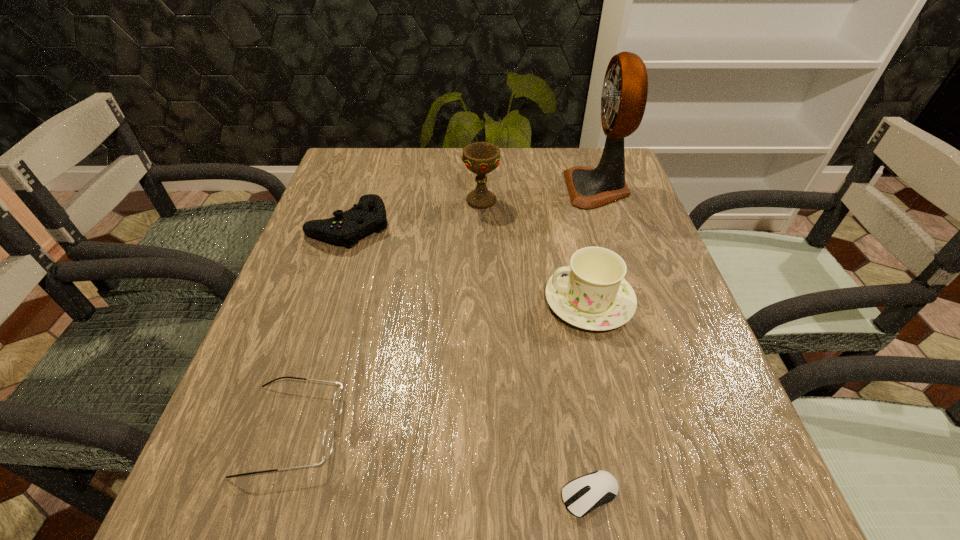
At what (x,y) coordinates should I click in order to perform the action: click on the tallest object. Please return your answer as a coordinate pair (x, y). The width and height of the screenshot is (960, 540). Looking at the image, I should click on (624, 95).

You are a GUI agent. You are given a task and a screenshot of the screen. Output one action in this format:
    pyautogui.click(x=<x>, y=<y>)
    Task: Click on the fifth shortest object
    The image size is (960, 540).
    Given the screenshot: What is the action you would take?
    pyautogui.click(x=481, y=158)

Find the location of a particular element. chalice is located at coordinates (481, 158).

This screenshot has height=540, width=960. I want to click on chinaware, so click(592, 294).

You are a GUI agent. You are given a task and a screenshot of the screen. Output one action in this format:
    pyautogui.click(x=<x>, y=<y>)
    Task: Click on the third nearest object
    The width and height of the screenshot is (960, 540).
    Given the screenshot: What is the action you would take?
    pyautogui.click(x=592, y=294)

At what (x,y) coordinates should I click in order to perform the action: click on the third shortest object. Please return your answer as a coordinate pair (x, y). Looking at the image, I should click on (345, 228).

You are a GUI agent. You are given a task and a screenshot of the screen. Output one action in this format:
    pyautogui.click(x=<x>, y=<y>)
    Task: Click on the fifth tallest object
    Image resolution: width=960 pixels, height=540 pixels.
    Given the screenshot: What is the action you would take?
    pyautogui.click(x=328, y=439)

Where is `the shortest object`? Image resolution: width=960 pixels, height=540 pixels. the shortest object is located at coordinates (582, 495).

Locate an element on the screen. The image size is (960, 540). free space located on the front-facing side of the tallest object is located at coordinates (495, 188).

This screenshot has height=540, width=960. Identify the location of vacant space located on the front-facing side of the tallest object. (499, 188).